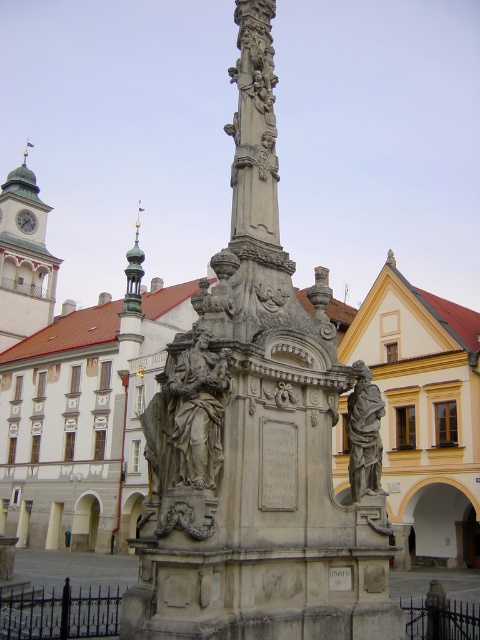
Does polished stone statue at center have a smaller size compared to white marble clock at upper center?

Yes, polished stone statue at center is smaller than white marble clock at upper center.

Identify the location of polished stone statue at center. This screenshot has width=480, height=640. (363, 435).

This screenshot has width=480, height=640. What are the coordinates of `polished stone statue at center` in the screenshot? It's located at (363, 435).

Which is above, gray stone monument at center or stone plaque at center?

gray stone monument at center is higher up.

From the picture: Which is more to the left, gray stone monument at center or stone plaque at center?

Positioned to the left is gray stone monument at center.

Is point (334, 515) in front of point (331, 586)?

That is False.

At what (x,y) coordinates should I click in order to perform the action: click on gray stone monument at center. Please return your answer as a coordinate pair (x, y). Looking at the image, I should click on pos(252,429).

Which is in front, point (275, 440) or point (347, 570)?

Point (347, 570) is more forward.

Who is shorter, white stone plaque at center or stone plaque at center?

stone plaque at center is shorter.

Between point (263, 508) and point (332, 570), which one is positioned in front?

Point (263, 508)

The image size is (480, 640). Find the location of `white stone plaque at center`. white stone plaque at center is located at coordinates (277, 465).